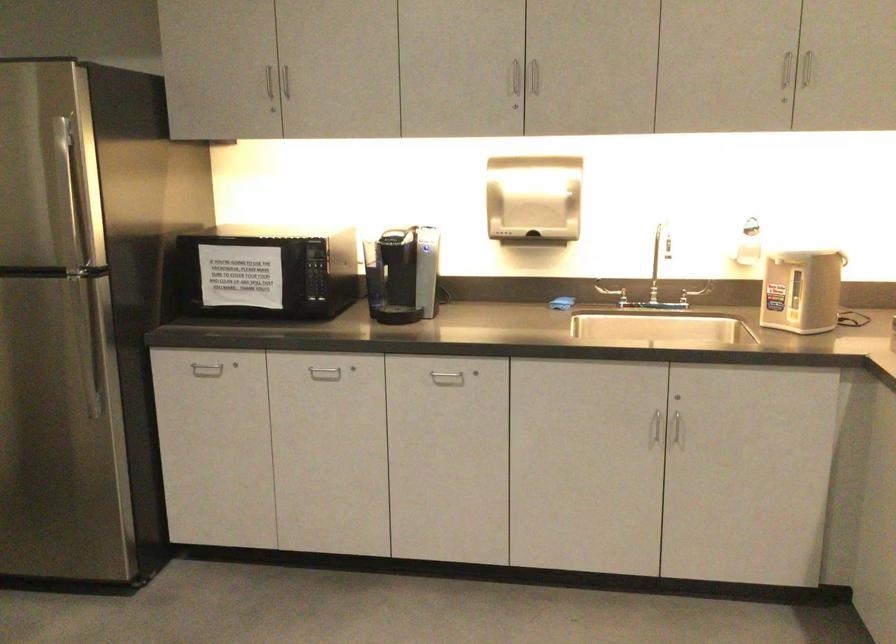
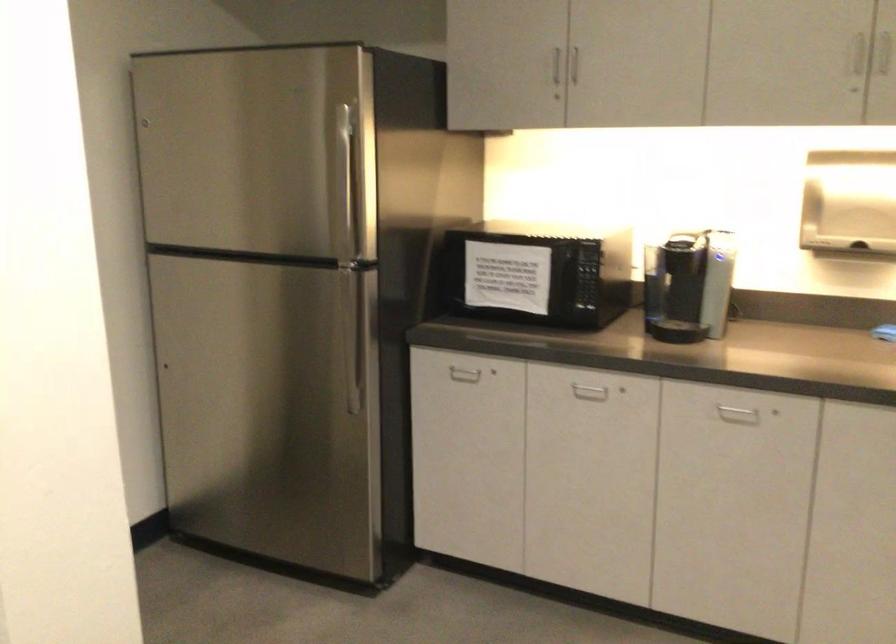
Question: The camera is either moving clockwise (left) or counter-clockwise (right) around the object. The first image is from the beginning of the video and the second image is from the end. Is the camera moving left or right when shooting the video?

Choices:
 (A) Left
 (B) Right

Answer: (B)